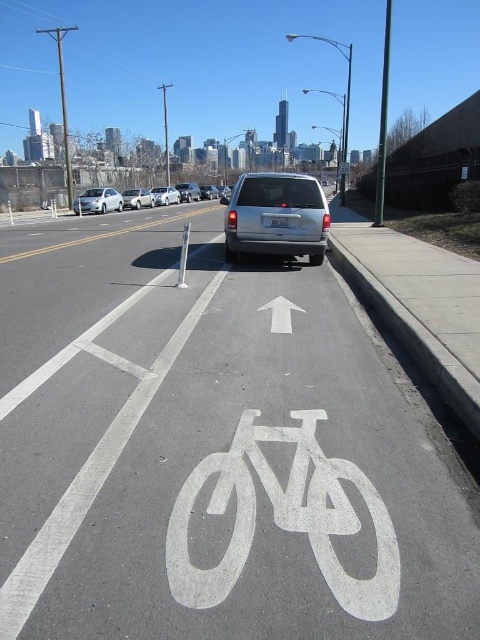
You are a cyclist approaching the bicycle lane marked with a white bicycle symbol and arrow. You see a white matte sedan at left and a satin silver van at center in the lane. Can you safely pass between them without leaving the lane?

The white matte sedan at left is 4.41 meters away from the satin silver van at center. Since the distance between them is sufficient for a cyclist to pass safely within the lane, you can proceed between them without leaving the bicycle lane.

You are a cyclist approaching the intersection and see the silver metallic van at center parked in the bicycle lane. If your bicycle is 2.5 feet wide, can you safely navigate around the van without leaving the bicycle lane?

The silver metallic van at center is parked in the bicycle lane, but the question does not provide information about the width of the bicycle lane or the space available around the van. Therefore, it is unclear if there is enough room to safely navigate around it while staying within the lane.

You are a cyclist approaching the white painted bicycle lane at center and the white matte sedan at left. Which object is closer to the ground?

The white painted bicycle lane at center is closer to the ground because it is below the white matte sedan at left.